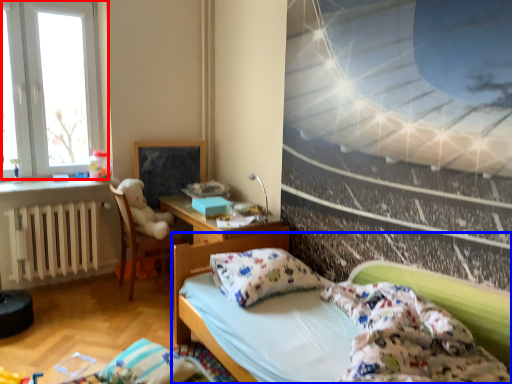
Question: Among these objects, which one is farthest to the camera, window (highlighted by a red box) or bed (highlighted by a blue box)?

Choices:
 (A) window
 (B) bed

Answer: (A)